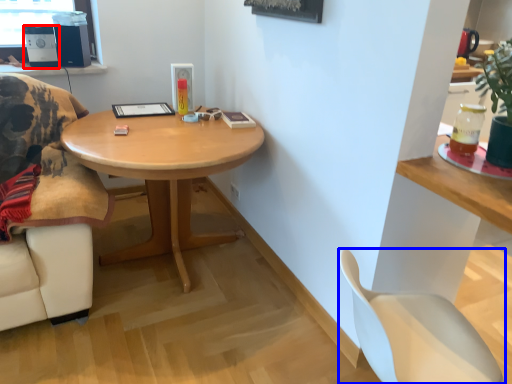
Question: Which object appears farthest to the camera in this image, speaker (highlighted by a red box) or chair (highlighted by a blue box)?

Choices:
 (A) speaker
 (B) chair

Answer: (A)